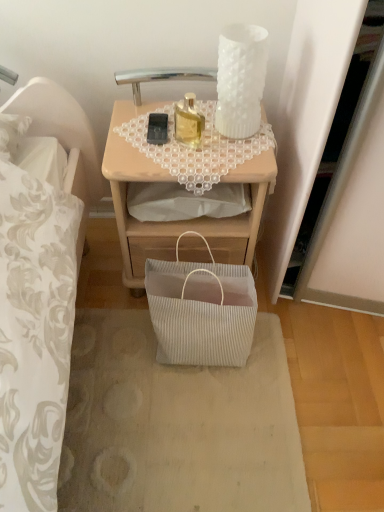
Where is `free point behind translucent glass bottle at center`? The width and height of the screenshot is (384, 512). free point behind translucent glass bottle at center is located at coordinates coord(189,120).